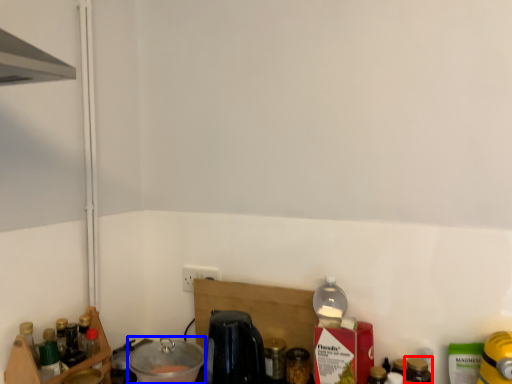
Question: Among these objects, which one is farthest to the camera, bottle (highlighted by a red box) or appliance (highlighted by a blue box)?

Choices:
 (A) bottle
 (B) appliance

Answer: (B)